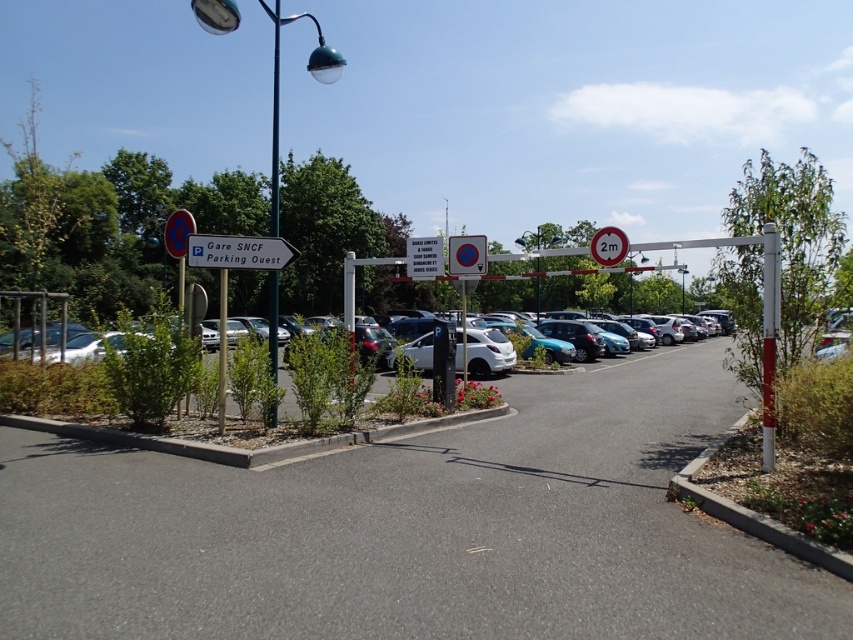
Question: Is asphalt at center further to the viewer compared to metallic pole at center?

Choices:
 (A) yes
 (B) no

Answer: (B)

Question: Which object is the farthest from the white plastic sign at center?

Choices:
 (A) white matte car at center
 (B) green metallic pole at upper left
 (C) metallic pole at center
 (D) white plastic sign at left

Answer: (B)

Question: Considering the real-world distances, which object is farthest from the white matte car at center?

Choices:
 (A) red plastic sign at center
 (B) white plastic sign at left
 (C) metallic pole at center

Answer: (C)

Question: Is metallic pole at right behind white matte car at center?

Choices:
 (A) yes
 (B) no

Answer: (B)

Question: Does metallic pole at right have a smaller size compared to white plastic sign at left?

Choices:
 (A) yes
 (B) no

Answer: (A)

Question: Estimate the real-world distances between objects in this image. Which object is farther from the white plastic sign at center?

Choices:
 (A) asphalt at center
 (B) white matte car at center
 (C) green metallic pole at upper left

Answer: (C)